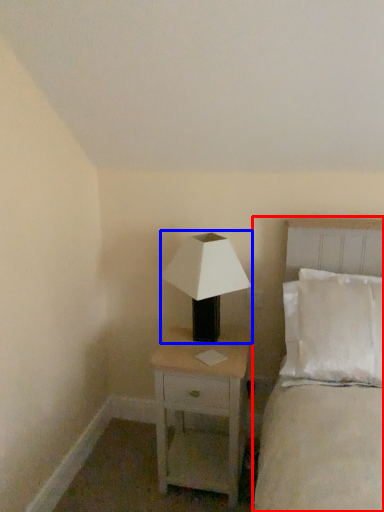
Question: Which object appears closest to the camera in this image, bed (highlighted by a red box) or lamp (highlighted by a blue box)?

Choices:
 (A) bed
 (B) lamp

Answer: (A)